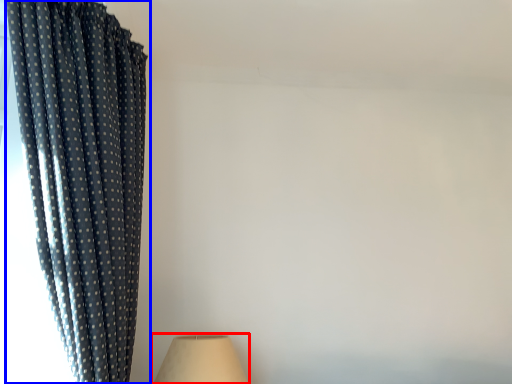
Question: Which object appears farthest to the camera in this image, lamp (highlighted by a red box) or curtain (highlighted by a blue box)?

Choices:
 (A) lamp
 (B) curtain

Answer: (A)